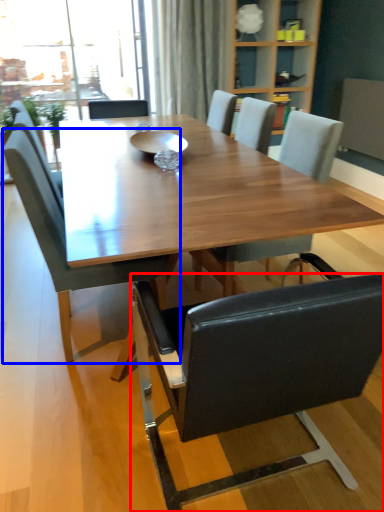
Question: Which object appears farthest to the camera in this image, chair (highlighted by a red box) or chair (highlighted by a blue box)?

Choices:
 (A) chair
 (B) chair

Answer: (B)